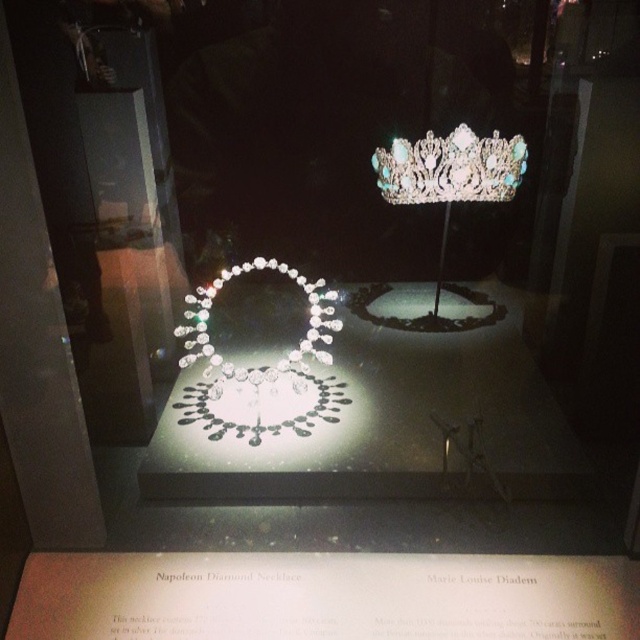
Is clear crystal crown at upper center bigger than clear crystal necklace at center?

Incorrect, clear crystal crown at upper center is not larger than clear crystal necklace at center.

Who is positioned more to the right, clear crystal crown at upper center or clear crystal necklace at center?

clear crystal crown at upper center is more to the right.

Is point (474, 154) behind point (273, 365)?

No, (474, 154) is closer to viewer.

The width and height of the screenshot is (640, 640). I want to click on clear crystal crown at upper center, so click(x=451, y=168).